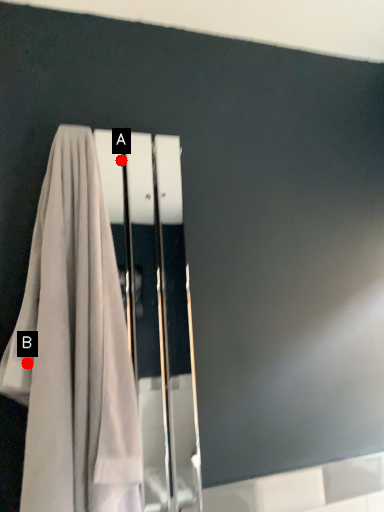
Question: Two points are circled on the image, labeled by A and B beside each circle. Among these points, which one is nearest to the camera?

Choices:
 (A) A is closer
 (B) B is closer

Answer: (B)